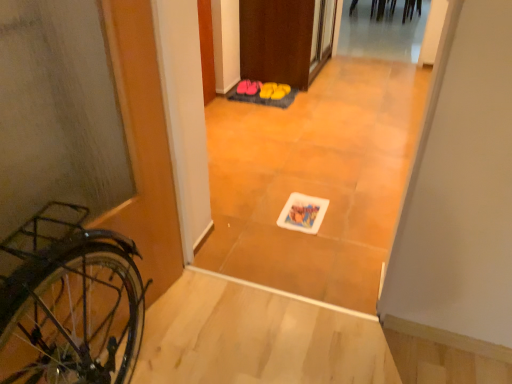
Question: From the image's perspective, is yellow rubber boots at center, arranged as the 5th footwear when viewed from the left, located above pink fabric slippers at center, arranged as the 3th footwear when viewed from the left?

Choices:
 (A) no
 (B) yes

Answer: (B)

Question: Is yellow rubber boots at center, arranged as the 5th footwear when viewed from the left, positioned before pink fabric slippers at center, arranged as the 3th footwear when viewed from the left?

Choices:
 (A) no
 (B) yes

Answer: (A)

Question: Is yellow rubber boots at center, marked as the 1th footwear in a right-to-left arrangement, facing away from pink fabric slippers at center, arranged as the 3th footwear when viewed from the left?

Choices:
 (A) yes
 (B) no

Answer: (B)

Question: Is yellow rubber boots at center, marked as the 1th footwear in a right-to-left arrangement, to the right of pink fabric slippers at center, arranged as the 3th footwear when viewed from the left, from the viewer's perspective?

Choices:
 (A) yes
 (B) no

Answer: (A)

Question: Is yellow rubber boots at center, marked as the 1th footwear in a right-to-left arrangement, to the left of pink fabric slippers at center, the third footwear viewed from the right, from the viewer's perspective?

Choices:
 (A) no
 (B) yes

Answer: (A)

Question: From a real-world perspective, is pink fabric slippers at center, which is the 4th footwear in right-to-left order, physically located above or below pink fabric slippers at center, arranged as the 3th footwear when viewed from the left?

Choices:
 (A) above
 (B) below

Answer: (A)

Question: Visually, is pink fabric slippers at center, the second footwear from the left, positioned to the left or to the right of pink fabric slippers at center, arranged as the 3th footwear when viewed from the left?

Choices:
 (A) right
 (B) left

Answer: (B)

Question: Considering the positions of point (259, 82) and point (270, 82), is point (259, 82) closer or farther from the camera than point (270, 82)?

Choices:
 (A) farther
 (B) closer

Answer: (A)

Question: From the image's perspective, relative to pink fabric slippers at center, arranged as the 3th footwear when viewed from the left, is pink fabric slippers at center, which is the 4th footwear in right-to-left order, above or below?

Choices:
 (A) below
 (B) above

Answer: (B)

Question: In terms of width, does matte black bicycle at left look wider or thinner when compared to yellow rubber boots at center, arranged as the 5th footwear when viewed from the left?

Choices:
 (A) wide
 (B) thin

Answer: (A)

Question: From the image's perspective, is matte black bicycle at left positioned above or below yellow rubber boots at center, arranged as the 5th footwear when viewed from the left?

Choices:
 (A) below
 (B) above

Answer: (A)

Question: In the image, is matte black bicycle at left on the left side or the right side of yellow rubber boots at center, arranged as the 5th footwear when viewed from the left?

Choices:
 (A) right
 (B) left

Answer: (B)

Question: Do you think matte black bicycle at left is within yellow rubber boots at center, arranged as the 5th footwear when viewed from the left, or outside of it?

Choices:
 (A) outside
 (B) inside

Answer: (A)

Question: Is matte black bicycle at left wider or thinner than pink fabric slippers at center, the third footwear viewed from the right?

Choices:
 (A) wide
 (B) thin

Answer: (A)

Question: Do you think matte black bicycle at left is within pink fabric slippers at center, arranged as the 3th footwear when viewed from the left, or outside of it?

Choices:
 (A) outside
 (B) inside

Answer: (A)